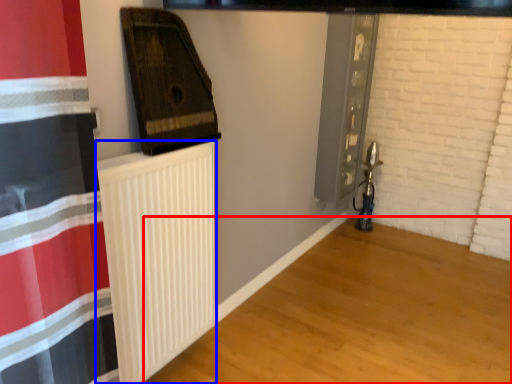
Question: Which object appears closest to the camera in this image, wood (highlighted by a red box) or radiator (highlighted by a blue box)?

Choices:
 (A) wood
 (B) radiator

Answer: (A)